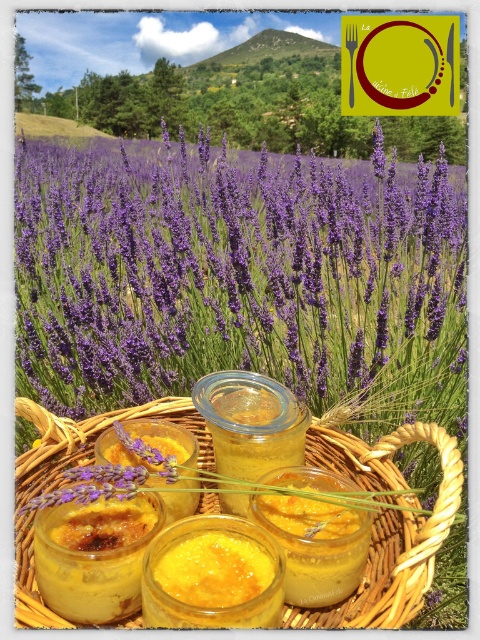
Between point (142, 218) and point (287, 456), which one is positioned behind?

The point (142, 218) is behind.

Does purple matte lavender at center have a lesser width compared to transparent glass jar at center?

Incorrect, purple matte lavender at center's width is not less than transparent glass jar at center's.

I want to click on purple matte lavender at center, so click(229, 273).

Between yellow translucent mustard at center and transparent glass jar at center, which one has less height?

yellow translucent mustard at center is shorter.

Find the location of `yellow translucent mustard at center`. yellow translucent mustard at center is located at coordinates (213, 576).

Image resolution: width=480 pixels, height=640 pixels. I want to click on yellow translucent mustard at center, so click(213, 576).

This screenshot has width=480, height=640. Identify the location of yellow translucent mustard at center. (213, 576).

Is woven straw basket at center to the right of transparent glass jar at center from the viewer's perspective?

Incorrect, woven straw basket at center is not on the right side of transparent glass jar at center.

Does woven straw basket at center lie in front of transparent glass jar at center?

Yes, it is.

In the scene shown: Measure the distance between woven straw basket at center and camera.

woven straw basket at center is 17.90 inches away from camera.

Locate an element on the screen. This screenshot has height=640, width=480. woven straw basket at center is located at coordinates (385, 525).